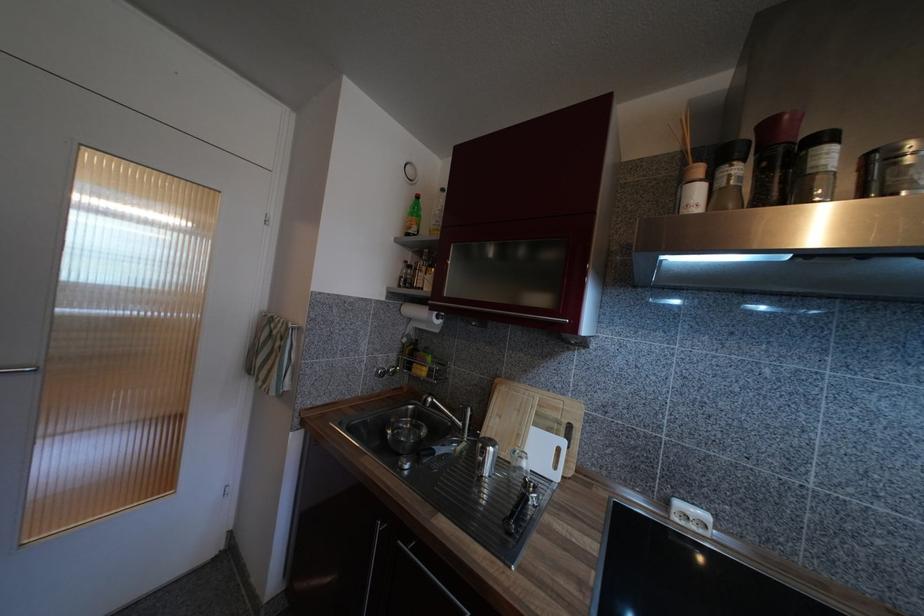
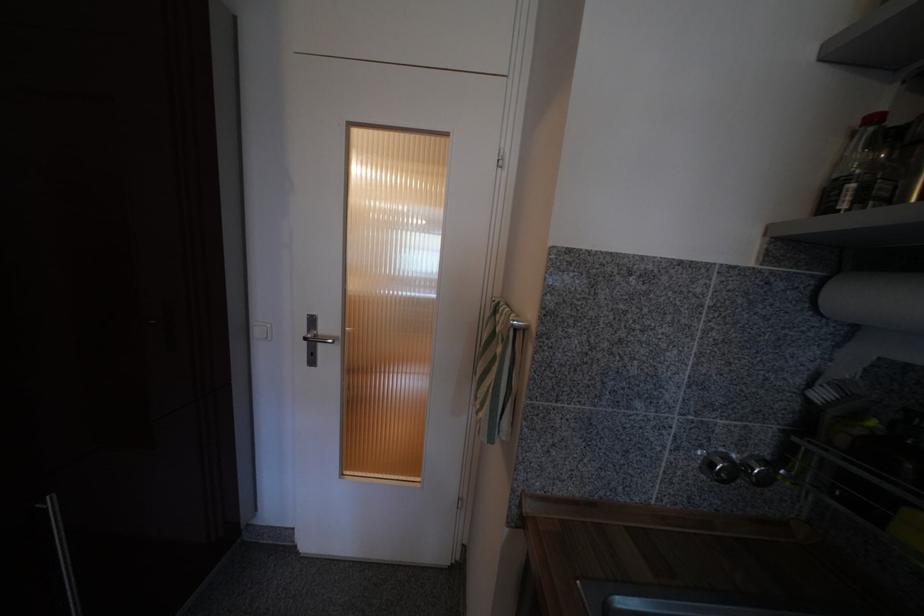
Question: The camera is either moving clockwise (left) or counter-clockwise (right) around the object. The first image is from the beginning of the video and the second image is from the end. Is the camera moving left or right when shooting the video?

Choices:
 (A) Left
 (B) Right

Answer: (B)